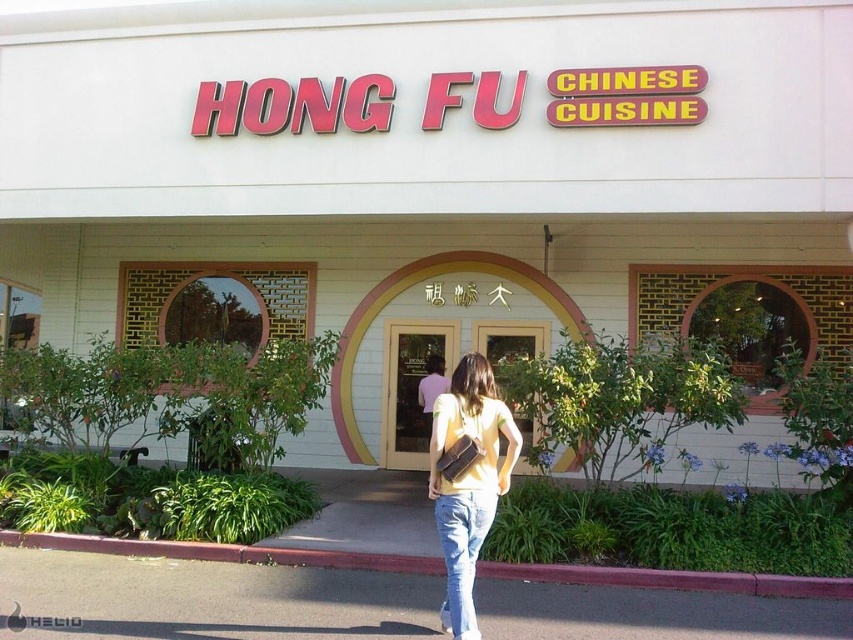
You are trying to decide which item to wear for a casual day out. You have a yellow matte shirt at center and jeans at center. Which item has a wider width?

The yellow matte shirt at center has a larger width than the jeans at center.

You are standing in front of the Hong Fu Chinese Cuisine restaurant and notice the gray asphalt at lower center and the yellow matte shirt at center. Which object is located to the left of the other?

The gray asphalt at lower center is positioned on the left side of yellow matte shirt at center.